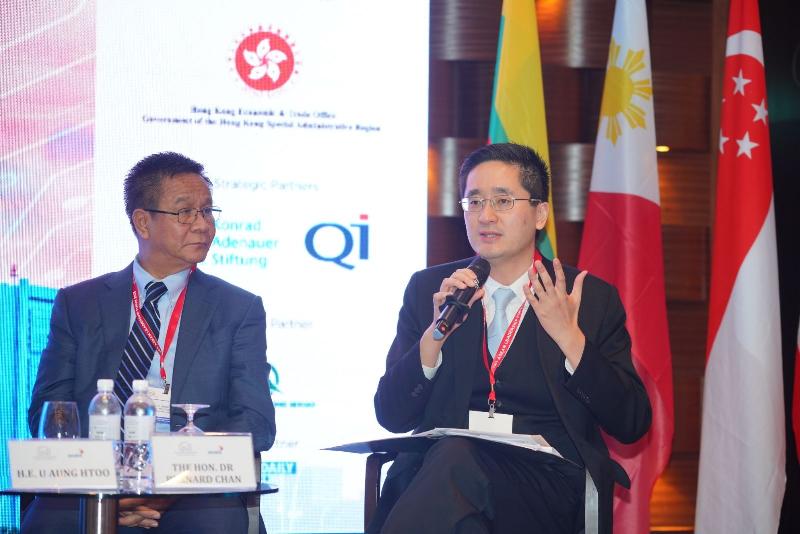
Image resolution: width=800 pixels, height=534 pixels. Find the location of `wine glasses`. wine glasses is located at coordinates (58, 425), (190, 413).